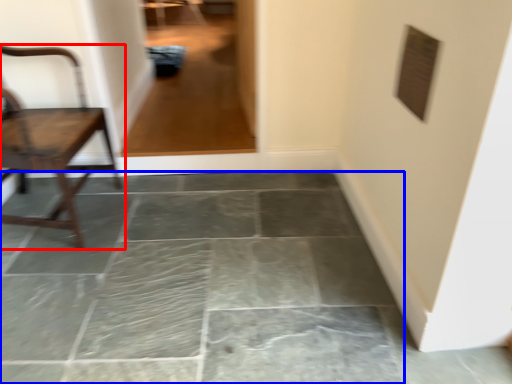
Question: Among these objects, which one is nearest to the camera, chair (highlighted by a red box) or concrete (highlighted by a blue box)?

Choices:
 (A) chair
 (B) concrete

Answer: (B)